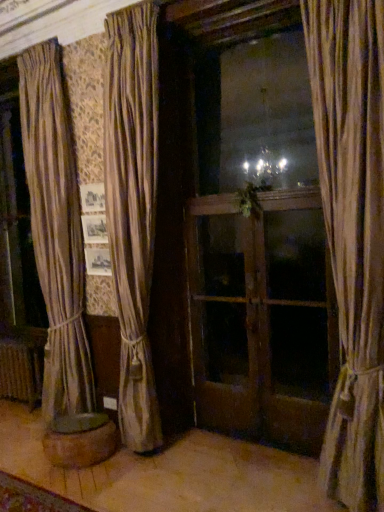
Find the location of a particular element. vacant space underneath green leafy plant at center (from a real-world perspective) is located at coordinates (261, 443).